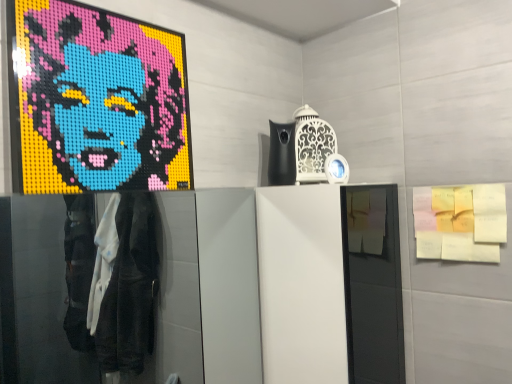
Question: Looking at the image, does yellow sticky notes at upper right seem bigger or smaller compared to brick mosaic portrait at upper left?

Choices:
 (A) big
 (B) small

Answer: (B)

Question: Based on their positions, is yellow sticky notes at upper right located to the left or right of brick mosaic portrait at upper left?

Choices:
 (A) left
 (B) right

Answer: (B)

Question: From their relative heights in the image, would you say yellow sticky notes at upper right is taller or shorter than brick mosaic portrait at upper left?

Choices:
 (A) tall
 (B) short

Answer: (B)

Question: Considering their positions, is brick mosaic portrait at upper left located in front of or behind yellow sticky notes at upper right?

Choices:
 (A) behind
 (B) front

Answer: (B)

Question: Is brick mosaic portrait at upper left wider or thinner than yellow sticky notes at upper right?

Choices:
 (A) thin
 (B) wide

Answer: (A)

Question: Is point (68, 112) closer or farther from the camera than point (467, 213)?

Choices:
 (A) farther
 (B) closer

Answer: (B)

Question: Based on their positions, is brick mosaic portrait at upper left located to the left or right of yellow sticky notes at upper right?

Choices:
 (A) right
 (B) left

Answer: (B)